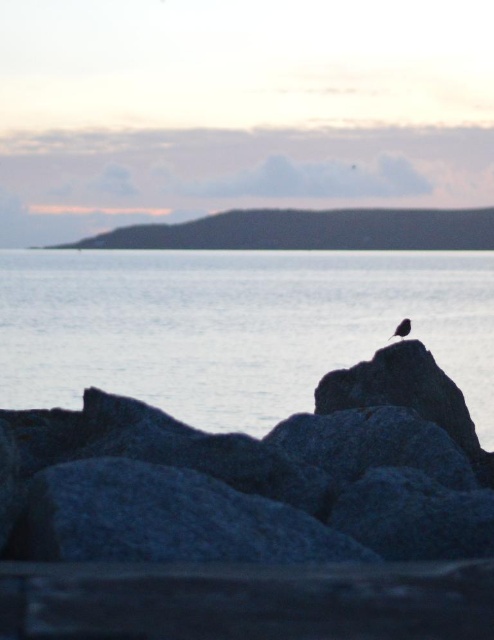
You are a drone operator trying to capture the perfect shot of the blue water at center. Your drone is currently hovering at point (235, 326). Is the blue water at center located directly below your drone?

Yes, the blue water at center is located directly below the drone at point (235, 326).

You are a photographer trying to capture the blue water at center and the silvery metallic bird at center in the same frame. Based on their positions, which one will appear larger in the photo?

The blue water at center appears larger in the photo because it is taller than the silvery metallic bird at center.